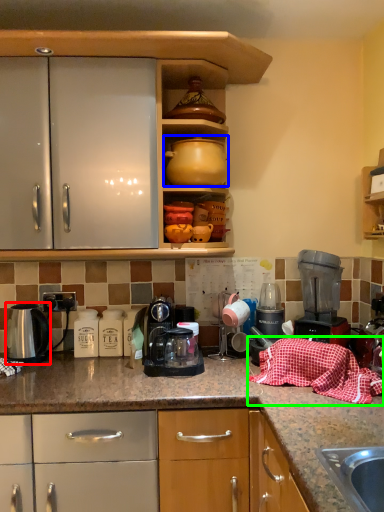
Question: Estimate the real-world distances between objects in this image. Which object is farther from kitchen appliance (highlighted by a red box), coffeepot (highlighted by a blue box) or blanket (highlighted by a green box)?

Choices:
 (A) coffeepot
 (B) blanket

Answer: (B)